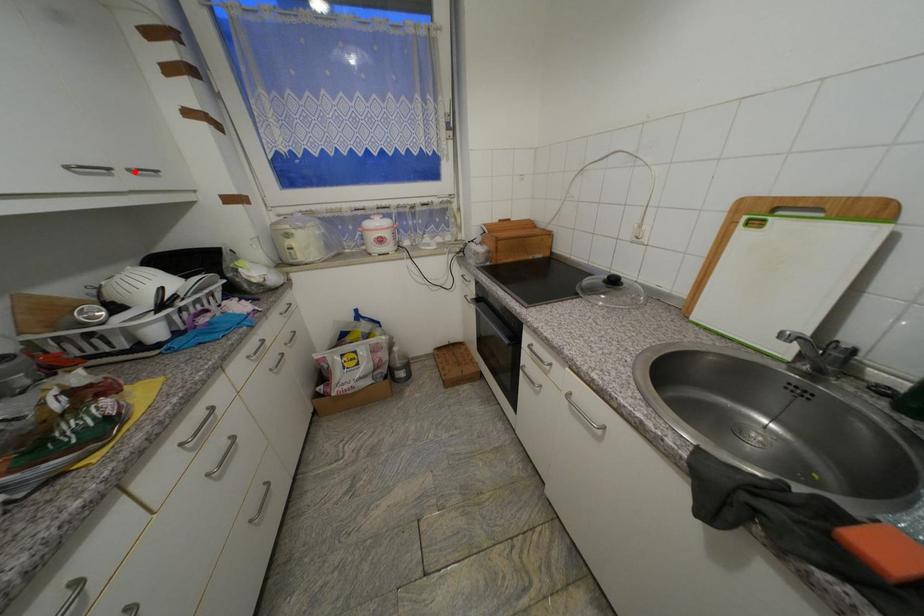
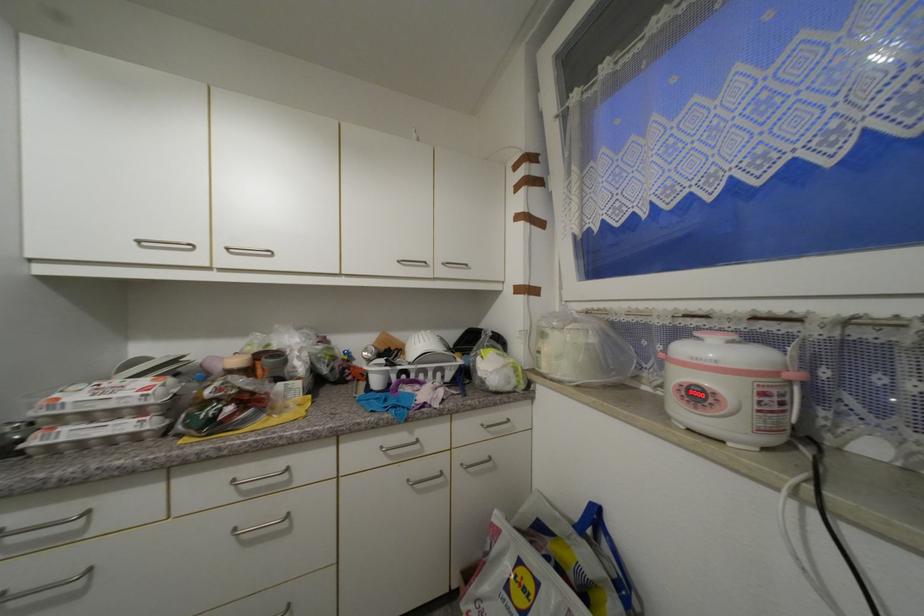
In the second image, find the point that corresponds to the highlighted location in the first image.

(448, 265)